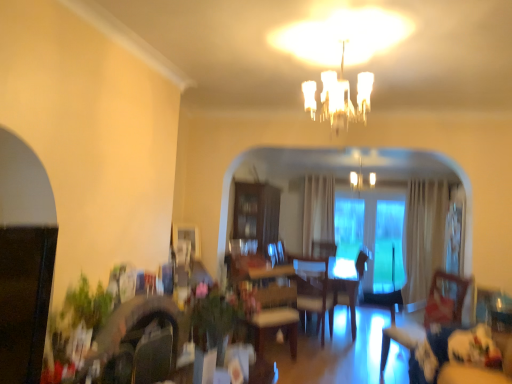
What do you see at coordinates (421, 347) in the screenshot? The image size is (512, 384). I see `velvet blue couch at lower right` at bounding box center [421, 347].

Identify the location of transparent glass door at center. (374, 235).

Which is closer to the camera, [367,177] or [432,286]?

Positioned in front is point [432,286].

Does white frosted glass chandelier at upper center have a greater width compared to wooden swivel chair at lower right?

Incorrect, the width of white frosted glass chandelier at upper center does not surpass that of wooden swivel chair at lower right.

From the image's perspective, is white frosted glass chandelier at upper center above or below wooden swivel chair at lower right?

white frosted glass chandelier at upper center is situated higher than wooden swivel chair at lower right in the image.

Is wooden swivel chair at lower right completely or partially inside white frosted glass chandelier at upper center?

No, wooden swivel chair at lower right is not surrounded by white frosted glass chandelier at upper center.

Can you confirm if transparent glass door at center is positioned to the left of clear glass chandelier at upper center?

In fact, transparent glass door at center is to the right of clear glass chandelier at upper center.

Is transparent glass door at center positioned with its back to clear glass chandelier at upper center?

transparent glass door at center is not turned away from clear glass chandelier at upper center.

Can you confirm if transparent glass door at center is shorter than clear glass chandelier at upper center?

Incorrect, the height of transparent glass door at center does not fall short of that of clear glass chandelier at upper center.

The height and width of the screenshot is (384, 512). I want to click on light fixture that is in front of the transparent glass door at center, so click(344, 97).

Which is correct: clear glass chandelier at upper center is inside velvet blue couch at lower right, or outside of it?

The correct answer is: outside.

Does clear glass chandelier at upper center appear on the right side of velvet blue couch at lower right?

No.

Does clear glass chandelier at upper center have a greater height compared to velvet blue couch at lower right?

Yes.

Which object is positioned more to the left, light brown leather armchair at center or wooden swivel chair at lower right?

Positioned to the left is light brown leather armchair at center.

Which object is closer to the camera taking this photo, light brown leather armchair at center or wooden swivel chair at lower right?

wooden swivel chair at lower right is closer to the camera.

Between point (362, 261) and point (393, 335), which one is positioned behind?

The point (362, 261) is more distant.

Who is bigger, light brown leather armchair at center or wooden swivel chair at lower right?

Bigger between the two is wooden swivel chair at lower right.

Can you confirm if light brown leather armchair at center is shorter than clear glass chandelier at upper center?

Incorrect, the height of light brown leather armchair at center does not fall short of that of clear glass chandelier at upper center.

Locate an element on the screen. The width and height of the screenshot is (512, 384). light fixture lying in front of the light brown leather armchair at center is located at coordinates (344, 97).

Between light brown leather armchair at center and clear glass chandelier at upper center, which one is positioned in front?

clear glass chandelier at upper center is closer to the camera.

Which is more to the left, light brown leather armchair at center or clear glass chandelier at upper center?

Positioned to the left is clear glass chandelier at upper center.

From the image's perspective, is velvet blue couch at lower right beneath white frosted glass chandelier at upper center?

Yes, from the image's perspective, velvet blue couch at lower right is beneath white frosted glass chandelier at upper center.

Between velvet blue couch at lower right and white frosted glass chandelier at upper center, which one is positioned in front?

velvet blue couch at lower right is in front.

Considering the relative positions of velvet blue couch at lower right and white frosted glass chandelier at upper center in the image provided, is velvet blue couch at lower right to the left or to the right of white frosted glass chandelier at upper center?

From the image, it's evident that velvet blue couch at lower right is to the left of white frosted glass chandelier at upper center.

Find the location of `light fixture to the left of white frosted glass chandelier at upper center`. light fixture to the left of white frosted glass chandelier at upper center is located at coordinates (344, 97).

Could you tell me if white frosted glass chandelier at upper center is turned towards clear glass chandelier at upper center?

Yes, white frosted glass chandelier at upper center is facing clear glass chandelier at upper center.

Considering the points (355, 189) and (311, 112), which point is in front, point (355, 189) or point (311, 112)?

The point (311, 112) is more forward.

This screenshot has width=512, height=384. I want to click on swivel chair below the white frosted glass chandelier at upper center (from a real-world perspective), so click(x=426, y=315).

I want to click on glass door behind the clear glass chandelier at upper center, so click(x=374, y=235).

When comparing their distances from wooden swivel chair at lower right, does velvet blue couch at lower right or white frosted glass chandelier at upper center seem closer?

The object closer to wooden swivel chair at lower right is velvet blue couch at lower right.

When comparing their distances from velvet blue couch at lower right, does transparent glass door at center or clear glass chandelier at upper center seem further?

→ transparent glass door at center is positioned further to the anchor velvet blue couch at lower right.

Considering their positions, is velvet blue couch at lower right positioned closer to clear glass chandelier at upper center than light brown leather armchair at center?

Among the two, velvet blue couch at lower right is located nearer to clear glass chandelier at upper center.

Considering their positions, is white frosted glass chandelier at upper center positioned closer to velvet blue couch at lower right than clear glass chandelier at upper center?

clear glass chandelier at upper center is closer to velvet blue couch at lower right.

Based on their spatial positions, is transparent glass door at center or velvet blue couch at lower right further from white frosted glass chandelier at upper center?

Based on the image, velvet blue couch at lower right appears to be further to white frosted glass chandelier at upper center.

From the image, which object appears to be nearer to light brown leather armchair at center, velvet blue couch at lower right or white frosted glass chandelier at upper center?

white frosted glass chandelier at upper center is closer to light brown leather armchair at center.

Estimate the real-world distances between objects in this image. Which object is further from white frosted glass chandelier at upper center, velvet blue couch at lower right or transparent glass door at center?

velvet blue couch at lower right.

Which object lies nearer to the anchor point clear glass chandelier at upper center, wooden swivel chair at lower right or velvet blue couch at lower right?

wooden swivel chair at lower right.

The image size is (512, 384). Identify the location of swivel chair between clear glass chandelier at upper center and transparent glass door at center along the z-axis. (426, 315).

The height and width of the screenshot is (384, 512). I want to click on armchair between velvet blue couch at lower right and white frosted glass chandelier at upper center along the z-axis, so click(348, 284).

In order to click on armchair located between clear glass chandelier at upper center and transparent glass door at center in the depth direction in this screenshot , I will do `click(348, 284)`.

Where is `swivel chair between clear glass chandelier at upper center and light brown leather armchair at center along the z-axis`? The image size is (512, 384). swivel chair between clear glass chandelier at upper center and light brown leather armchair at center along the z-axis is located at coordinates (426, 315).